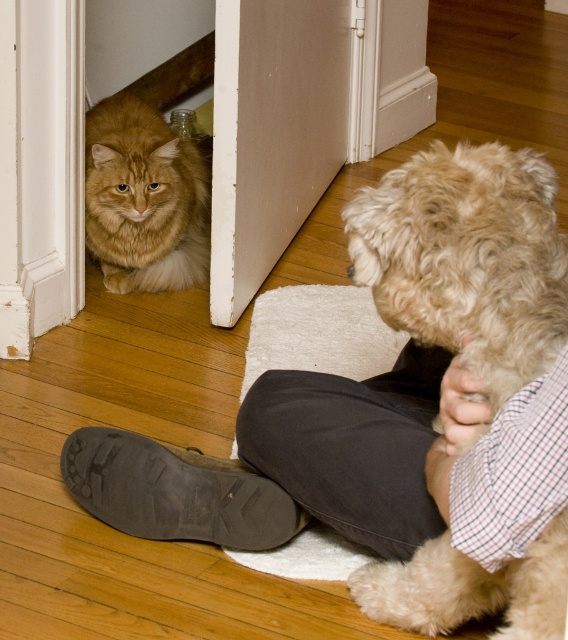
You are standing in the room and want to approach the golden fur cat at lower left. Based on the scene, which direction should you move to reach the cat?

The golden fur cat at lower left is located at point (x=144, y=198), so you should move towards the lower left direction to reach it.

You are standing in the room and want to move towards the white door in the background. There is a fluffy beige dog at lower right in your way. Can you walk around the dog without stepping on it? Please explain your reasoning based on the dog and your position.

The fluffy beige dog at lower right is located at coordinates point (x=467, y=259). Since you are standing in the room and the dog is at lower right, you can walk around it either to the left or right side to reach the door without stepping on the dog.

You are standing at the point labeled point (396, 292) in the image. You want to take a photo of the fluffy, light brown dog with curly fur sitting on the floor. Is the dog within the camera frame if the camera has a standard 50mm focal length and is positioned at the camera location?

The distance between the point labeled point (396, 292) and the camera is 1.24 meters. With a standard 50mm focal length, the field of view is approximately 46 degrees. Since the dog is sitting on the floor near the camera, it should be within the camera frame.